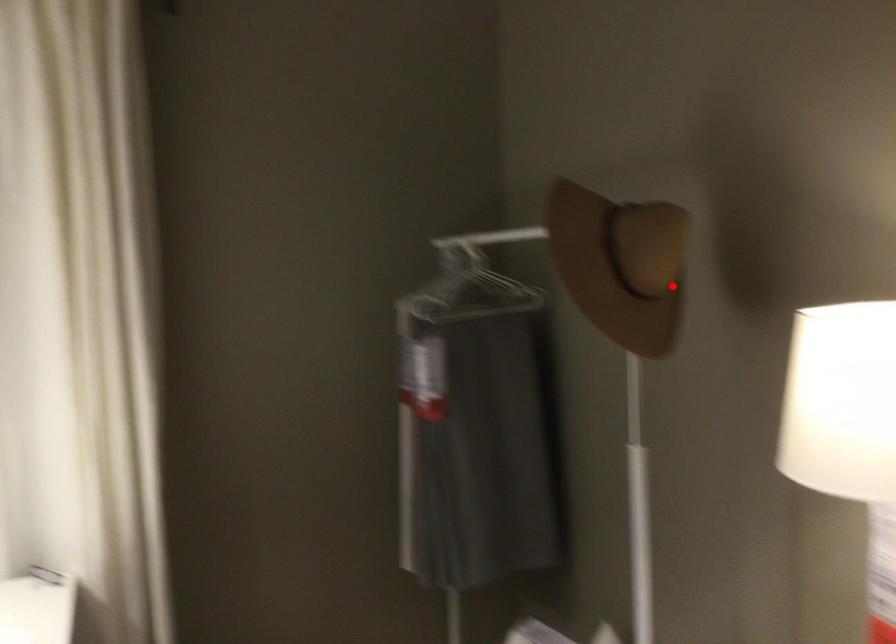
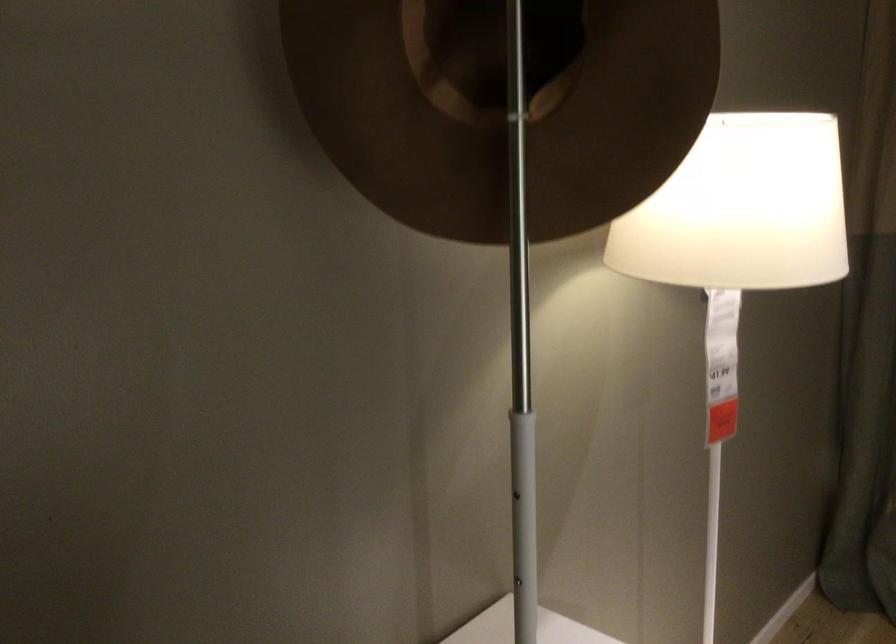
Question: I am providing you with two images of the same scene from different viewpoints. A red point is shown in image1. For the corresponding object point in image2, is it positioned nearer or farther from the camera?

Choices:
 (A) Nearer
 (B) Farther

Answer: (A)